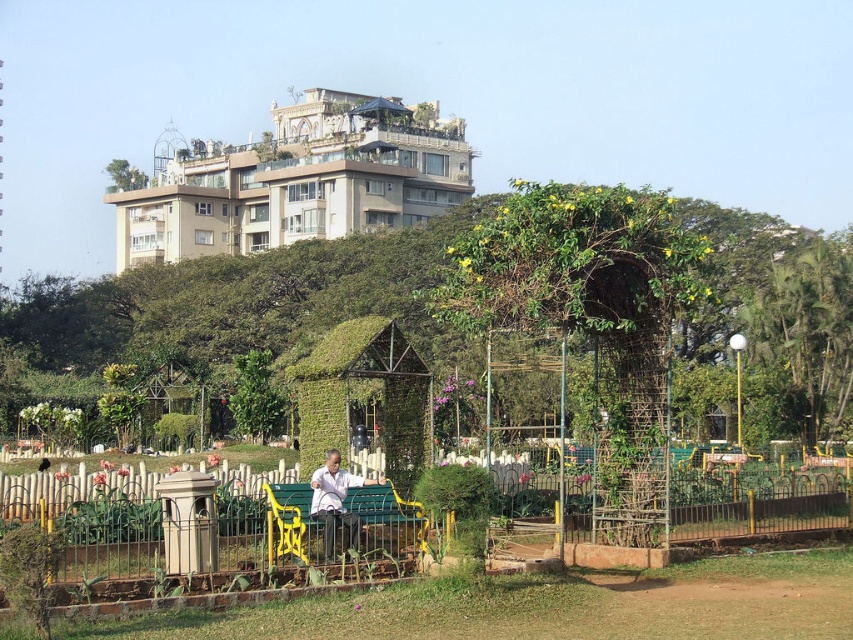
Which is behind, point (657, 506) or point (846, 257)?

Positioned behind is point (846, 257).

Is green leafy arch at center taller than green leafy tree at right?

Yes.

Is point (625, 188) positioned in front of point (787, 344)?

No.

This screenshot has height=640, width=853. What are the coordinates of `green leafy arch at center` in the screenshot? It's located at (592, 320).

Looking at this image, is green ivy-covered structure at center above green painted wood bench at center?

Indeed, green ivy-covered structure at center is positioned over green painted wood bench at center.

Who is taller, green ivy-covered structure at center or green painted wood bench at center?

Standing taller between the two is green ivy-covered structure at center.

In order to click on green ivy-covered structure at center in this screenshot , I will do `click(242, 304)`.

Identify the location of green ivy-covered structure at center. click(242, 304).

At what (x,y) coordinates should I click in order to perform the action: click on green ivy-covered structure at center. Please return your answer as a coordinate pair (x, y). Looking at the image, I should click on (242, 304).

Is green ivy-covered structure at center taller than green leafy arch at center?

Indeed, green ivy-covered structure at center has a greater height compared to green leafy arch at center.

Who is more distant from viewer, (426,340) or (642,280)?

Point (426,340)

You are a GUI agent. You are given a task and a screenshot of the screen. Output one action in this format:
    pyautogui.click(x=<x>, y=<y>)
    Task: Click on the green ivy-covered structure at center
    The width and height of the screenshot is (853, 640).
    Given the screenshot: What is the action you would take?
    pyautogui.click(x=242, y=304)